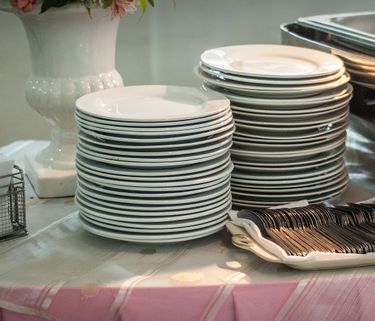
Locate an element on the screen. pans is located at coordinates (365, 83), (364, 72), (363, 67), (363, 63), (360, 39).